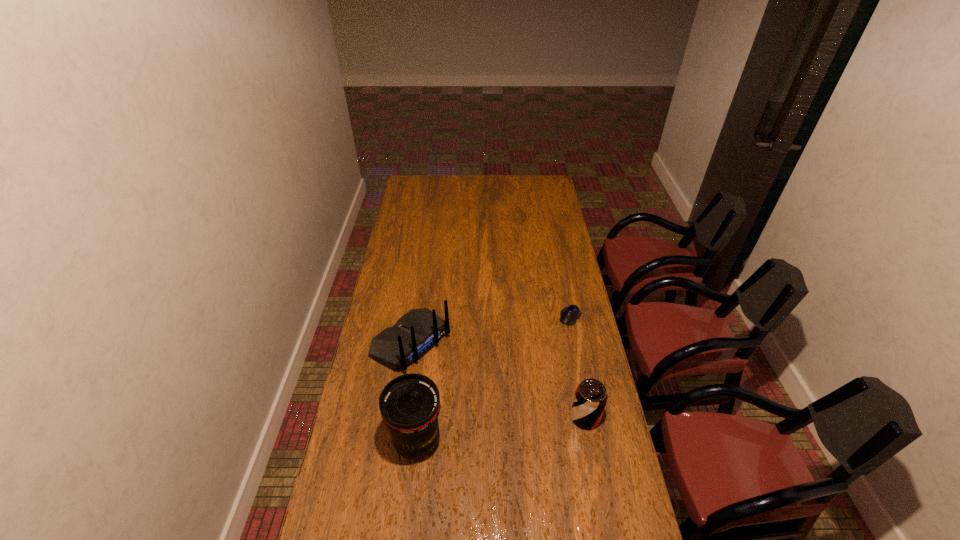
This screenshot has height=540, width=960. Identify the location of free spot on the desktop that is between the telephoto lens and the soda can and is positioned on the button side of the computer mouse. pyautogui.click(x=500, y=429).

The height and width of the screenshot is (540, 960). What are the coordinates of `vacant space on the desktop that is between the tallest object and the third tallest object and is positioned on the back of the second tallest object` in the screenshot? It's located at (525, 426).